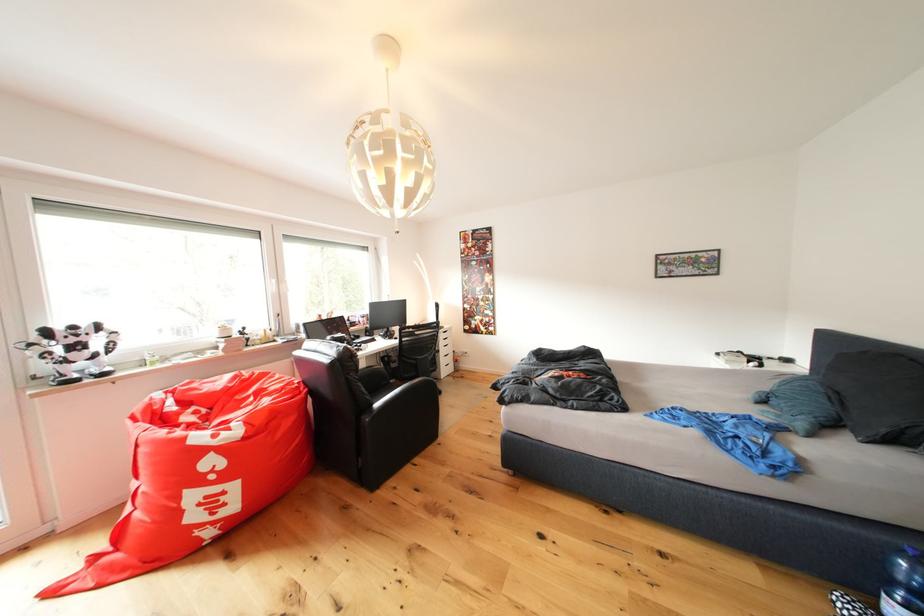
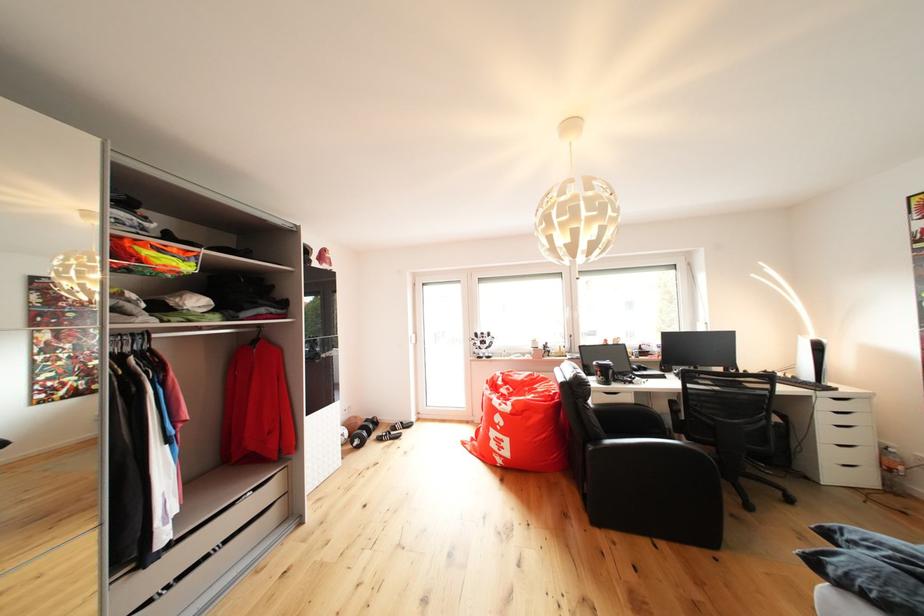
In the second image, find the point that corresponds to the point at 457,355 in the first image.

(869, 444)